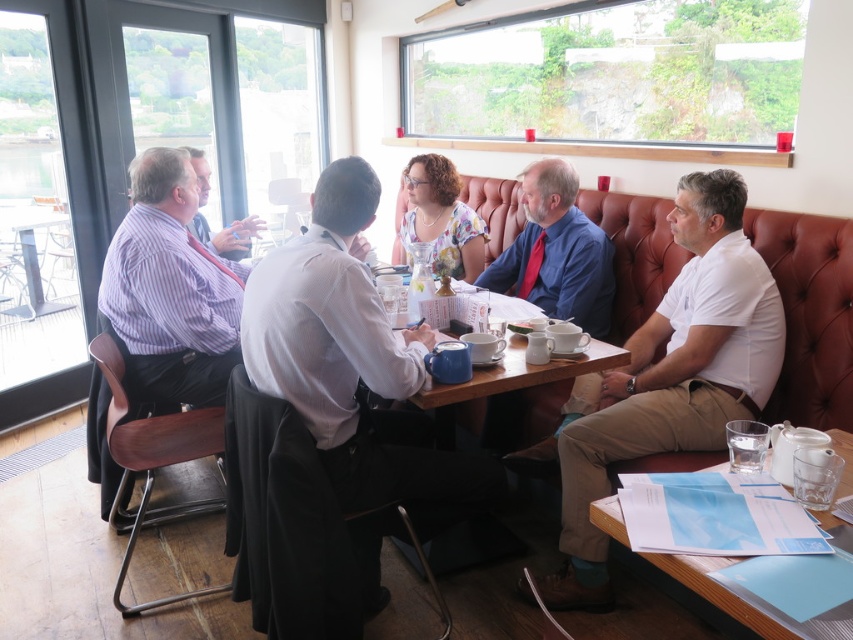
Is point (840, 433) positioned after point (743, 468)?

Yes, point (840, 433) is farther from viewer.

Between point (674, 573) and point (735, 440), which one is positioned behind?

Point (735, 440)

Locate an element on the screen. wooden table at lower right is located at coordinates (717, 592).

Can you confirm if striped shirt at left is positioned to the left of matte blue shirt at center?

Indeed, striped shirt at left is positioned on the left side of matte blue shirt at center.

Is striped shirt at left above matte blue shirt at center?

Actually, striped shirt at left is below matte blue shirt at center.

The image size is (853, 640). What do you see at coordinates (173, 285) in the screenshot? I see `striped shirt at left` at bounding box center [173, 285].

This screenshot has height=640, width=853. I want to click on striped shirt at left, so click(173, 285).

Is wooden table at lower right wider than matte white shirt at center?

In fact, wooden table at lower right might be narrower than matte white shirt at center.

Who is positioned more to the right, wooden table at lower right or matte white shirt at center?

wooden table at lower right

Between point (735, 614) and point (248, 220), which one is positioned behind?

Point (248, 220)

At what (x,y) coordinates should I click in order to perform the action: click on wooden table at lower right. Please return your answer as a coordinate pair (x, y). Looking at the image, I should click on (717, 592).